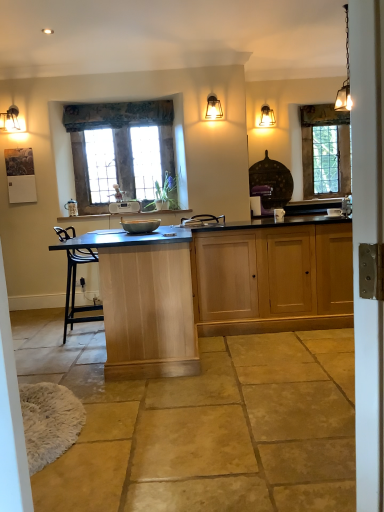
Question: Can you confirm if metallic chain-link lamp at upper right, which is the fourth lamp in left-to-right order, is positioned to the right of matte gray bowl at center?

Choices:
 (A) yes
 (B) no

Answer: (A)

Question: From a real-world perspective, is metallic chain-link lamp at upper right, which ranks as the 1th lamp in front-to-back order, beneath matte gray bowl at center?

Choices:
 (A) no
 (B) yes

Answer: (A)

Question: Is metallic chain-link lamp at upper right, which appears as the first lamp when viewed from the right, thinner than matte gray bowl at center?

Choices:
 (A) no
 (B) yes

Answer: (B)

Question: Can you confirm if metallic chain-link lamp at upper right, which appears as the first lamp when viewed from the right, is shorter than matte gray bowl at center?

Choices:
 (A) no
 (B) yes

Answer: (A)

Question: Can you confirm if metallic chain-link lamp at upper right, which appears as the first lamp when viewed from the right, is positioned to the left of matte gray bowl at center?

Choices:
 (A) yes
 (B) no

Answer: (B)

Question: Is metallic chain-link lamp at upper right, which is the fourth lamp in left-to-right order, positioned beyond the bounds of matte gray bowl at center?

Choices:
 (A) yes
 (B) no

Answer: (A)

Question: Can you confirm if matte gray bowl at center is shorter than matte glass pendant light at upper right, which is the 3th lamp from left to right?

Choices:
 (A) yes
 (B) no

Answer: (A)

Question: Considering the relative positions of matte gray bowl at center and matte glass pendant light at upper right, which is the 3th lamp from left to right, in the image provided, is matte gray bowl at center behind matte glass pendant light at upper right, which is the 3th lamp from left to right,?

Choices:
 (A) yes
 (B) no

Answer: (B)

Question: From the image's perspective, is matte gray bowl at center on top of matte glass pendant light at upper right, the 1th lamp positioned from the back?

Choices:
 (A) no
 (B) yes

Answer: (A)

Question: Is matte glass pendant light at upper right, the 2th lamp in the right-to-left sequence, at the back of matte gray bowl at center?

Choices:
 (A) yes
 (B) no

Answer: (B)

Question: Is matte gray bowl at center with matte glass pendant light at upper right, the 2th lamp in the right-to-left sequence?

Choices:
 (A) no
 (B) yes

Answer: (A)

Question: Is matte gray bowl at center at the left side of matte glass pendant light at upper right, the 1th lamp positioned from the back?

Choices:
 (A) no
 (B) yes

Answer: (B)

Question: Are floral fabric curtain at upper center and matte glass pendant light at upper right, the 2th lamp in the right-to-left sequence, located far from each other?

Choices:
 (A) yes
 (B) no

Answer: (A)